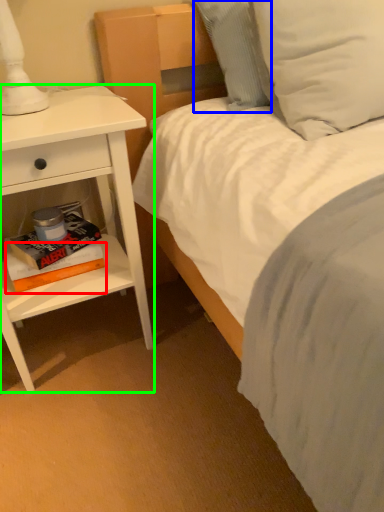
Question: Which object is positioned closest to paperback book (highlighted by a red box)? Select from pillow (highlighted by a blue box) and nightstand (highlighted by a green box).

Choices:
 (A) pillow
 (B) nightstand

Answer: (B)